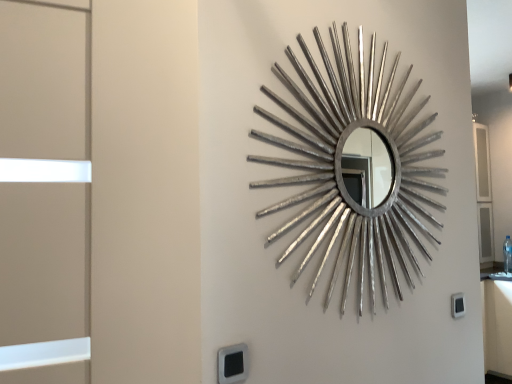
Question: From the image's perspective, is black plastic electric outlet at lower center, the first electric outlet in the front-to-back sequence, positioned above or below black plastic electric outlet at lower right, which is the 2th electric outlet from left to right?

Choices:
 (A) below
 (B) above

Answer: (B)

Question: Is point (245, 360) positioned closer to the camera than point (451, 311)?

Choices:
 (A) closer
 (B) farther

Answer: (A)

Question: Which object is the closest to the black plastic electric outlet at lower center, the first electric outlet in the front-to-back sequence?

Choices:
 (A) silver metallic mirror at center
 (B) black plastic electric outlet at lower right, which appears as the 1th electric outlet when viewed from the right

Answer: (A)

Question: Which of these objects is positioned closest to the black plastic electric outlet at lower center, the second electric outlet in the back-to-front sequence?

Choices:
 (A) black plastic electric outlet at lower right, which is the 2th electric outlet from left to right
 (B) silver metallic mirror at center

Answer: (B)